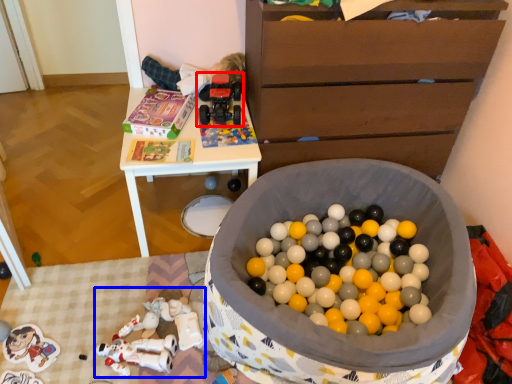
Question: Which of the following is the farthest to the observer, toy (highlighted by a red box) or toy (highlighted by a blue box)?

Choices:
 (A) toy
 (B) toy

Answer: (A)